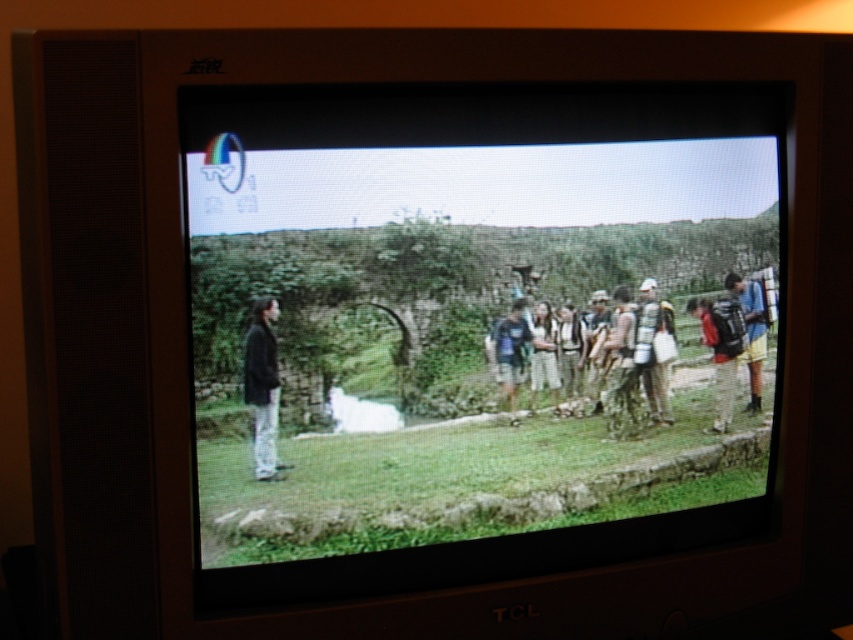
You are a hiker who wants to choose between the camouflage fabric backpack at right and the blue fabric backpack at right based on their thickness. Which backpack is more suitable for carrying lightweight gear?

The camouflage fabric backpack at right is thinner than the blue fabric backpack at right, making it more suitable for carrying lightweight gear as it takes up less space.

From the picture: You are a hiker who needs to choose between the camouflage fabric backpack at right and the dark blue fabric backpack at center based on their height. Which backpack is taller?

The camouflage fabric backpack at right is much taller than the dark blue fabric backpack at center.